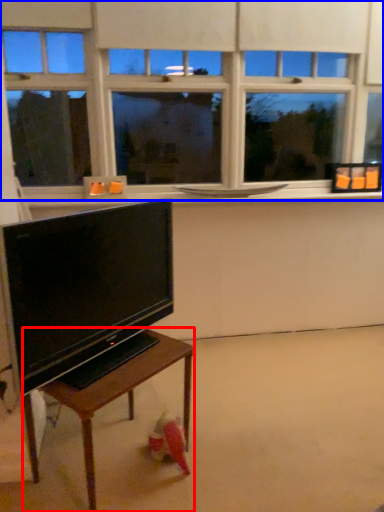
Question: Which of the following is the closest to the observer, table (highlighted by a red box) or window (highlighted by a blue box)?

Choices:
 (A) table
 (B) window

Answer: (A)